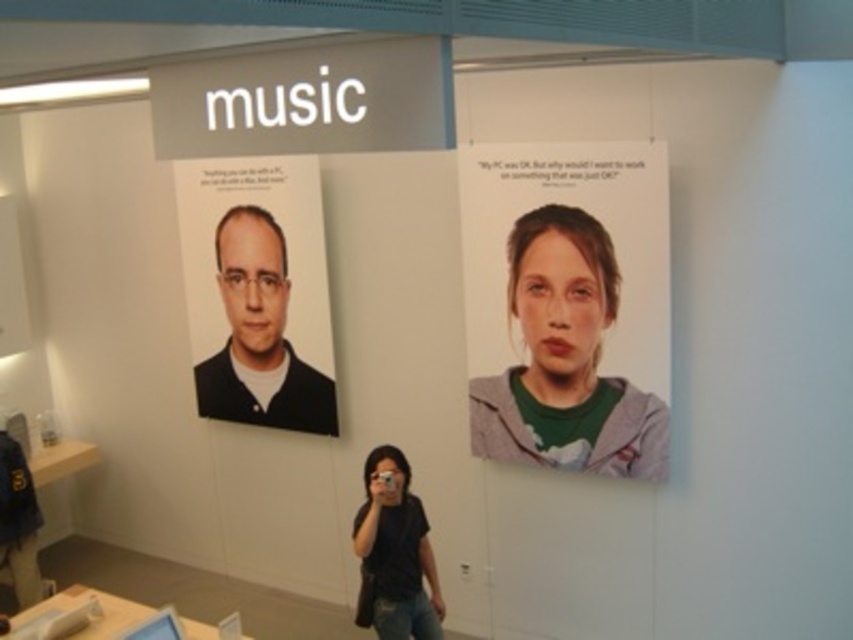
Can you confirm if matte black portrait at left is taller than black matte shirt at lower center?

Indeed, matte black portrait at left has a greater height compared to black matte shirt at lower center.

Image resolution: width=853 pixels, height=640 pixels. What do you see at coordinates (259, 337) in the screenshot?
I see `matte black portrait at left` at bounding box center [259, 337].

Who is more distant from viewer, (320, 422) or (363, 556)?

Positioned behind is point (320, 422).

Locate an element on the screen. Image resolution: width=853 pixels, height=640 pixels. matte black portrait at left is located at coordinates (259, 337).

Between green fabric face at upper right and matte black portrait at left, which one appears on the right side from the viewer's perspective?

Positioned to the right is green fabric face at upper right.

Is green fabric face at upper right above matte black portrait at left?

No.

The width and height of the screenshot is (853, 640). Describe the element at coordinates (566, 358) in the screenshot. I see `green fabric face at upper right` at that location.

The width and height of the screenshot is (853, 640). I want to click on green fabric face at upper right, so click(566, 358).

Between point (502, 438) and point (412, 548), which one is positioned behind?

The point (502, 438) is behind.

Between green fabric face at upper right and black matte shirt at lower center, which one appears on the left side from the viewer's perspective?

Positioned to the left is black matte shirt at lower center.

Locate an element on the screen. Image resolution: width=853 pixels, height=640 pixels. green fabric face at upper right is located at coordinates [x=566, y=358].

You are a GUI agent. You are given a task and a screenshot of the screen. Output one action in this format:
    pyautogui.click(x=<x>, y=<y>)
    Task: Click on the green fabric face at upper right
    This screenshot has width=853, height=640.
    Given the screenshot: What is the action you would take?
    pyautogui.click(x=566, y=358)